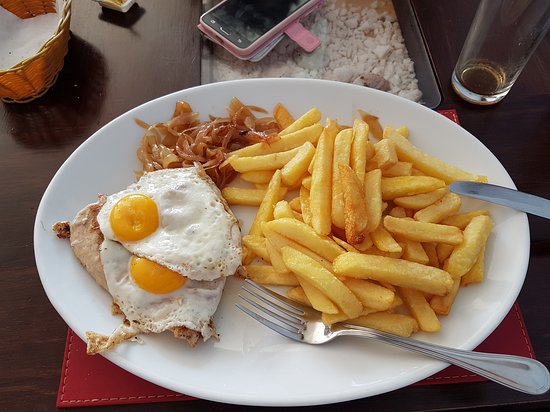
This screenshot has width=550, height=412. I want to click on white ceramic plate, so point(261,382).